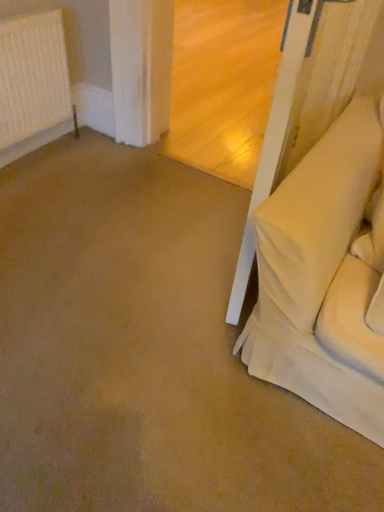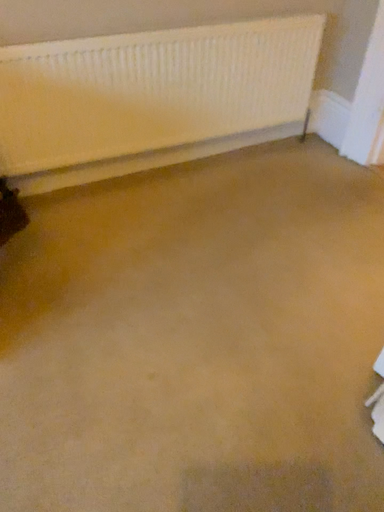
Question: How did the camera likely rotate when shooting the video?

Choices:
 (A) rotated upward
 (B) rotated downward

Answer: (A)